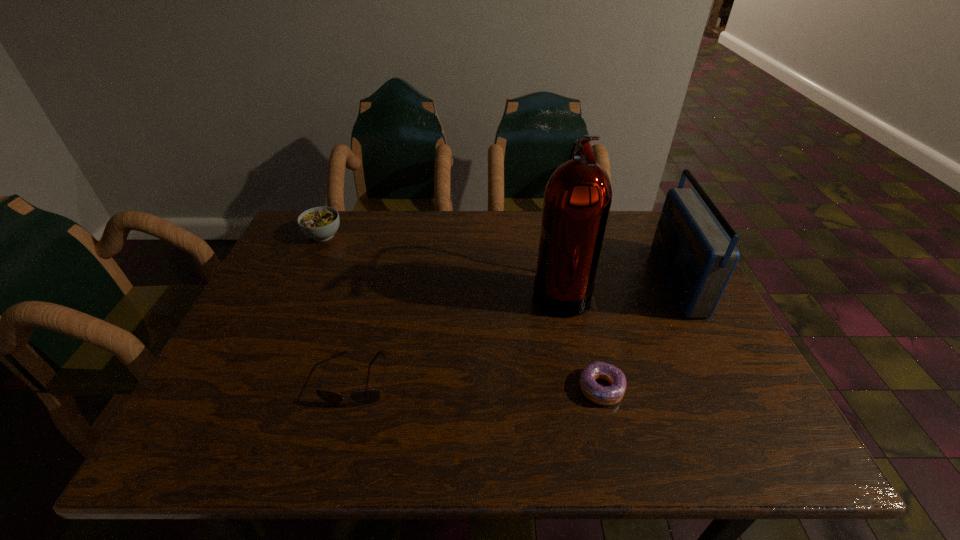
The width and height of the screenshot is (960, 540). I want to click on free space that is in between the fire extinguisher and the doughnut, so click(x=581, y=339).

At what (x,y) coordinates should I click in order to perform the action: click on object that can be found as the third closest to the shortest object. Please return your answer as a coordinate pair (x, y). Image resolution: width=960 pixels, height=540 pixels. Looking at the image, I should click on (366, 397).

Identify which object is located as the third nearest to the radio receiver. Please provide its 2D coordinates. Your answer should be formatted as a tuple, i.e. [(x, y)], where the tuple contains the x and y coordinates of a point satisfying the conditions above.

[(366, 397)]

What are the coordinates of `free space that satisfies the following two spatial constraints: 1. on the front-facing side of the fire extinguisher; 2. on the left side of the shortest object` in the screenshot? It's located at (580, 388).

You are a GUI agent. You are given a task and a screenshot of the screen. Output one action in this format:
    pyautogui.click(x=<x>, y=<y>)
    Task: Click on the vacant point that satisfies the following two spatial constraints: 1. on the front-facing side of the tallest object; 2. on the left side of the doughnut
    The image size is (960, 540).
    Given the screenshot: What is the action you would take?
    pyautogui.click(x=580, y=388)

What are the coordinates of `free region that satisfies the following two spatial constraints: 1. on the front-facing side of the shortest object; 2. on the left side of the fire extinguisher` in the screenshot? It's located at (580, 388).

Image resolution: width=960 pixels, height=540 pixels. Find the location of `blank space that satisfies the following two spatial constraints: 1. on the front-facing side of the tallest object; 2. on the back side of the doughnut`. blank space that satisfies the following two spatial constraints: 1. on the front-facing side of the tallest object; 2. on the back side of the doughnut is located at coordinates (580, 388).

At what (x,y) coordinates should I click in order to perform the action: click on free region that satisfies the following two spatial constraints: 1. on the front panel of the second tallest object; 2. on the front side of the shortest object. Please return your answer as a coordinate pair (x, y). This screenshot has width=960, height=540. Looking at the image, I should click on click(729, 388).